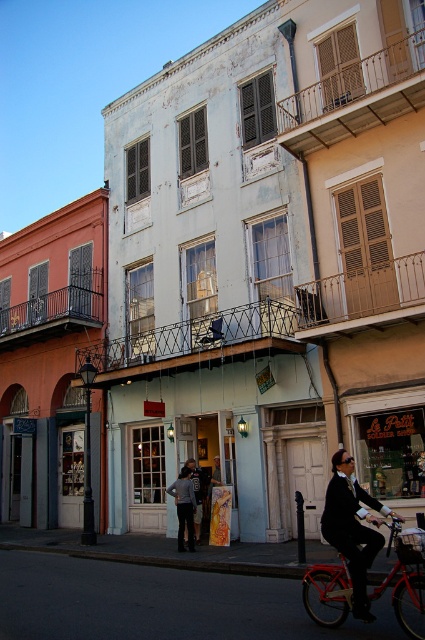
Between metallic red bicycle at center and dark gray pants at center, which one appears on the right side from the viewer's perspective?

From the viewer's perspective, metallic red bicycle at center appears more on the right side.

Is point (410, 605) behind point (181, 476)?

That is False.

The height and width of the screenshot is (640, 425). Find the location of `metallic red bicycle at center`. metallic red bicycle at center is located at coordinates (328, 593).

Is dark gray pants at center wider than dark gray fabric jacket at center?

Yes, dark gray pants at center is wider than dark gray fabric jacket at center.

Can you confirm if dark gray pants at center is positioned to the right of dark gray fabric jacket at center?

In fact, dark gray pants at center is to the left of dark gray fabric jacket at center.

Image resolution: width=425 pixels, height=640 pixels. Describe the element at coordinates (184, 506) in the screenshot. I see `dark gray pants at center` at that location.

This screenshot has height=640, width=425. Identify the location of dark gray pants at center. (184, 506).

Identify the location of metallic red bicycle at center. This screenshot has height=640, width=425. (328, 593).

Is metallic red bicycle at center behind matte black suit at lower right?

No, it is in front of matte black suit at lower right.

Between point (326, 582) and point (343, 554), which one is positioned behind?

Positioned behind is point (326, 582).

Locate an element on the screen. The image size is (425, 640). metallic red bicycle at center is located at coordinates (328, 593).